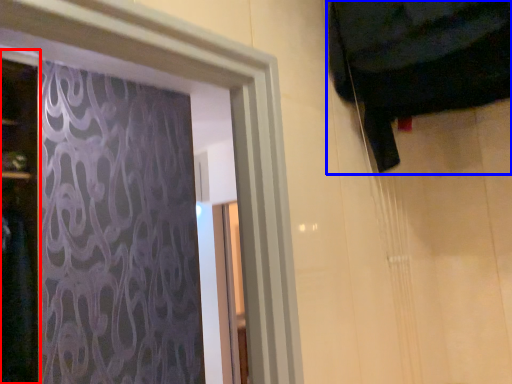
Question: Which object is further to the camera taking this photo, door (highlighted by a red box) or curtain (highlighted by a blue box)?

Choices:
 (A) door
 (B) curtain

Answer: (A)